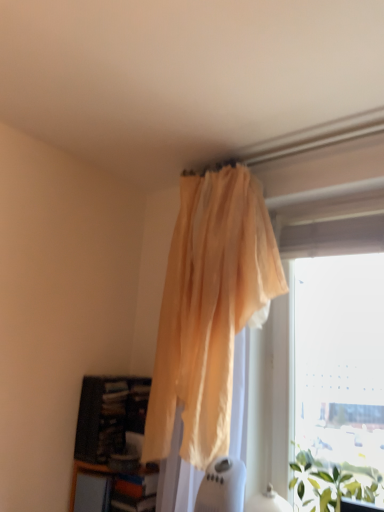
Identify the location of green leafy plant at lower right. Image resolution: width=384 pixels, height=512 pixels. (332, 482).

Find the location of `transparent plastic window at upper right`. transparent plastic window at upper right is located at coordinates (337, 364).

At what (x,y) coordinates should I click in order to perform the action: click on green leafy plant at lower right. Please return your answer as a coordinate pair (x, y). Image resolution: width=384 pixels, height=512 pixels. Looking at the image, I should click on (332, 482).

Locate an element on the screen. This screenshot has height=512, width=384. shelf below the translucent yellow curtain at upper center (from a real-world perspective) is located at coordinates (95, 487).

Based on the photo, is translucent yellow curtain at upper center positioned with its back to wooden/textured shelf at lower left?

translucent yellow curtain at upper center does not have its back to wooden/textured shelf at lower left.

Does translucent yellow curtain at upper center have a greater width compared to wooden/textured shelf at lower left?

Correct, the width of translucent yellow curtain at upper center exceeds that of wooden/textured shelf at lower left.

Are translucent yellow curtain at upper center and wooden/textured shelf at lower left located far from each other?

No, there isn't a large distance between translucent yellow curtain at upper center and wooden/textured shelf at lower left.

The width and height of the screenshot is (384, 512). In order to click on bookcase located underneath the translucent yellow curtain at upper center (from a real-world perspective) in this screenshot , I will do `click(112, 446)`.

How many degrees apart are the facing directions of translucent yellow curtain at upper center and dark wood bookcase at lower left?

3.51 degrees.

From the image's perspective, would you say translucent yellow curtain at upper center is positioned over dark wood bookcase at lower left?

Correct, translucent yellow curtain at upper center appears higher than dark wood bookcase at lower left in the image.

Is dark wood bookcase at lower left at the back of translucent yellow curtain at upper center?

No, translucent yellow curtain at upper center is not facing away from dark wood bookcase at lower left.

From the image's perspective, is green leafy plant at lower right above or below transparent plastic window at upper right?

green leafy plant at lower right is situated lower than transparent plastic window at upper right in the image.

Could you tell me if green leafy plant at lower right is facing transparent plastic window at upper right?

No, green leafy plant at lower right is not oriented towards transparent plastic window at upper right.

Can we say green leafy plant at lower right lies outside dark wood bookcase at lower left?

Indeed, green leafy plant at lower right is completely outside dark wood bookcase at lower left.

Is green leafy plant at lower right oriented towards dark wood bookcase at lower left?

No, green leafy plant at lower right does not turn towards dark wood bookcase at lower left.

From the image's perspective, is green leafy plant at lower right on top of dark wood bookcase at lower left?

No, from the image's perspective, green leafy plant at lower right is not over dark wood bookcase at lower left.

Which is more distant, (147, 481) or (367, 502)?

The point (147, 481) is farther from the camera.

What are the coordinates of `bookcase that appears above the green leafy plant at lower right (from the image's perspective)` in the screenshot? It's located at (112, 446).

From the image's perspective, is dark wood bookcase at lower left above green leafy plant at lower right?

Yes, from the image's perspective, dark wood bookcase at lower left is over green leafy plant at lower right.

Is dark wood bookcase at lower left thinner than wooden/textured shelf at lower left?

No.

Which object is closer to the camera, dark wood bookcase at lower left or wooden/textured shelf at lower left?

wooden/textured shelf at lower left.

Is dark wood bookcase at lower left positioned with its back to wooden/textured shelf at lower left?

No.

Is dark wood bookcase at lower left not inside transparent plastic window at upper right?

Yes, dark wood bookcase at lower left is outside of transparent plastic window at upper right.

Is dark wood bookcase at lower left far from transparent plastic window at upper right?

No.

You are a GUI agent. You are given a task and a screenshot of the screen. Output one action in this format:
    pyautogui.click(x=<x>, y=<y>)
    Task: Click on the bookcase on the left side of transparent plastic window at upper right
    This screenshot has width=384, height=512.
    Given the screenshot: What is the action you would take?
    pyautogui.click(x=112, y=446)

This screenshot has width=384, height=512. I want to click on curtain on the right of the wooden/textured shelf at lower left, so click(x=209, y=309).

You are a GUI agent. You are given a task and a screenshot of the screen. Output one action in this format:
    pyautogui.click(x=<x>, y=<y>)
    Task: Click on the bookcase that is below the translucent yellow curtain at upper center (from the image's perspective)
    Image resolution: width=384 pixels, height=512 pixels.
    Given the screenshot: What is the action you would take?
    pyautogui.click(x=112, y=446)

Looking at the image, which one is located further to green leafy plant at lower right, translucent yellow curtain at upper center or transparent plastic window at upper right?

translucent yellow curtain at upper center is positioned further to the anchor green leafy plant at lower right.

When comparing their distances from wooden/textured shelf at lower left, does translucent yellow curtain at upper center or dark wood bookcase at lower left seem closer?

dark wood bookcase at lower left is positioned closer to the anchor wooden/textured shelf at lower left.

Looking at this image, when comparing their distances from transparent plastic window at upper right, does translucent yellow curtain at upper center or wooden/textured shelf at lower left seem further?

wooden/textured shelf at lower left is further to transparent plastic window at upper right.

When comparing their distances from wooden/textured shelf at lower left, does dark wood bookcase at lower left or green leafy plant at lower right seem further?

green leafy plant at lower right.

When comparing their distances from translucent yellow curtain at upper center, does wooden/textured shelf at lower left or transparent plastic window at upper right seem further?

Based on the image, wooden/textured shelf at lower left appears to be further to translucent yellow curtain at upper center.

Based on their spatial positions, is transparent plastic window at upper right or wooden/textured shelf at lower left further from green leafy plant at lower right?

wooden/textured shelf at lower left is further to green leafy plant at lower right.

In the scene shown: When comparing their distances from translucent yellow curtain at upper center, does dark wood bookcase at lower left or wooden/textured shelf at lower left seem closer?

dark wood bookcase at lower left is positioned closer to the anchor translucent yellow curtain at upper center.

From the image, which object appears to be farther from wooden/textured shelf at lower left, green leafy plant at lower right or translucent yellow curtain at upper center?

green leafy plant at lower right lies further to wooden/textured shelf at lower left than the other object.

Find the location of a particular element. curtain between dark wood bookcase at lower left and green leafy plant at lower right is located at coordinates (209, 309).

Locate an element on the screen. Image resolution: width=384 pixels, height=512 pixels. plant that lies between transparent plastic window at upper right and wooden/textured shelf at lower left from top to bottom is located at coordinates (332, 482).

Locate an element on the screen. The width and height of the screenshot is (384, 512). shelf between dark wood bookcase at lower left and green leafy plant at lower right from left to right is located at coordinates (95, 487).

This screenshot has width=384, height=512. I want to click on bookcase between translucent yellow curtain at upper center and wooden/textured shelf at lower left in the up-down direction, so click(112, 446).